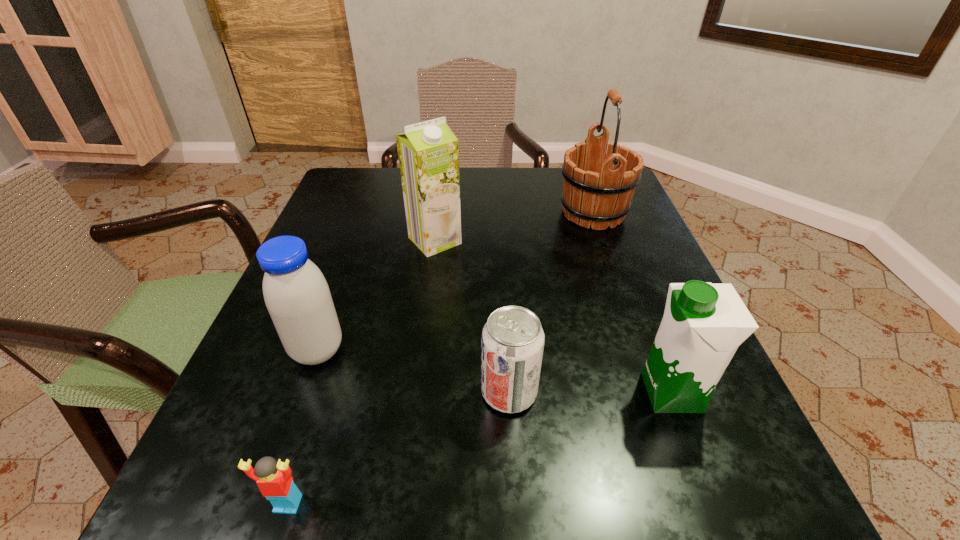
Where is `vacant space situated 0.100m on the back of the second soya milk from right to left`? The height and width of the screenshot is (540, 960). vacant space situated 0.100m on the back of the second soya milk from right to left is located at coordinates (440, 202).

I want to click on vacant space situated on the back of the leftmost soya milk, so click(360, 232).

Find the location of a particular element. blank space located 0.100m on the front-facing side of the rightmost soya milk is located at coordinates point(573,393).

Identify the location of vacant region located 0.200m on the front-facing side of the rightmost soya milk. (506, 393).

At what (x,y) coordinates should I click in order to perform the action: click on vacant area situated 0.240m on the front-facing side of the rightmost soya milk. Please return your answer as a coordinate pair (x, y). Image resolution: width=960 pixels, height=540 pixels. Looking at the image, I should click on (479, 393).

Find the location of a particular element. vacant region located on the right of the third object from right to left is located at coordinates (585, 392).

Locate an element on the screen. The height and width of the screenshot is (540, 960). object positioned at the far edge is located at coordinates (598, 186).

Where is `object located in the near edge section of the desktop`? The width and height of the screenshot is (960, 540). object located in the near edge section of the desktop is located at coordinates (274, 480).

This screenshot has width=960, height=540. I want to click on soya milk present at the left edge, so click(x=297, y=296).

This screenshot has width=960, height=540. I want to click on Lego located at the left edge, so click(274, 480).